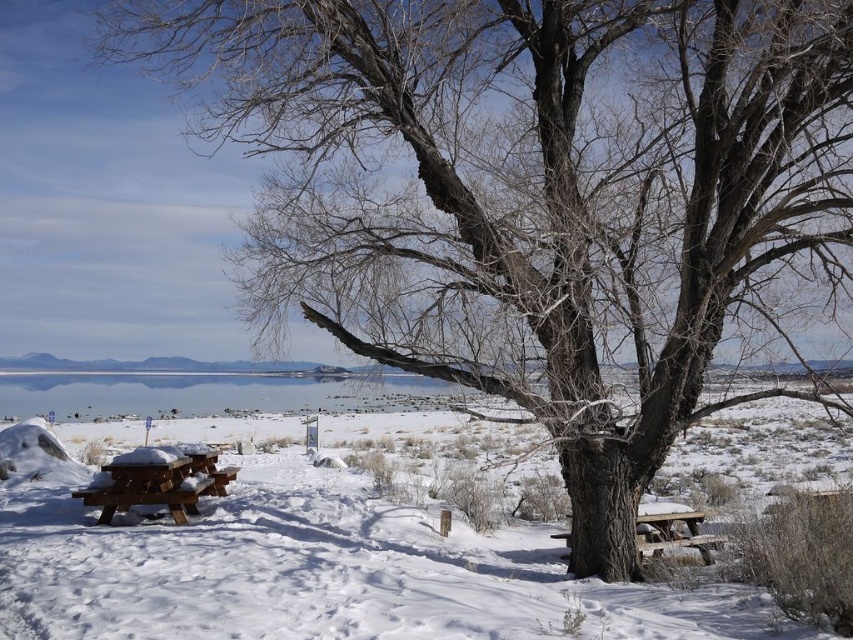
Describe the element at coordinates (158, 481) in the screenshot. I see `brown wooden picnic table at lower left` at that location.

Can you confirm if brown wooden picnic table at lower left is taller than wooden picnic table at lower right?

Yes, brown wooden picnic table at lower left is taller than wooden picnic table at lower right.

The width and height of the screenshot is (853, 640). Identify the location of brown wooden picnic table at lower left. click(x=158, y=481).

Is white powdery snow at lower left wider than brown wooden picnic table at lower left?

Yes, white powdery snow at lower left is wider than brown wooden picnic table at lower left.

What do you see at coordinates (317, 566) in the screenshot? I see `white powdery snow at lower left` at bounding box center [317, 566].

Image resolution: width=853 pixels, height=640 pixels. Identify the location of white powdery snow at lower left. (317, 566).

Image resolution: width=853 pixels, height=640 pixels. Describe the element at coordinates (317, 566) in the screenshot. I see `white powdery snow at lower left` at that location.

Who is shorter, white powdery snow at lower left or wooden picnic table at lower right?

Standing shorter between the two is wooden picnic table at lower right.

Is point (256, 531) positioned after point (703, 544)?

No, (256, 531) is in front of (703, 544).

Locate an element on the screen. white powdery snow at lower left is located at coordinates pyautogui.click(x=317, y=566).